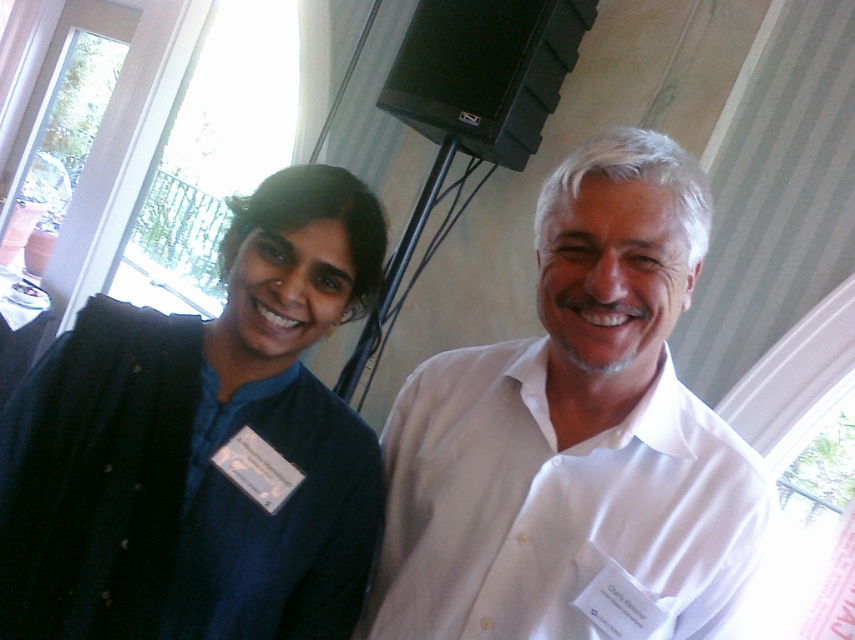
Question: Considering the relative positions of white cotton shirt at center and velvet blue shirt at left in the image provided, where is white cotton shirt at center located with respect to velvet blue shirt at left?

Choices:
 (A) left
 (B) right

Answer: (B)

Question: Is white cotton shirt at center closer to camera compared to velvet blue shirt at left?

Choices:
 (A) no
 (B) yes

Answer: (B)

Question: Which object is closer to the camera taking this photo?

Choices:
 (A) white cotton shirt at center
 (B) velvet blue shirt at left

Answer: (A)

Question: Can you confirm if white cotton shirt at center is positioned below velvet blue shirt at left?

Choices:
 (A) yes
 (B) no

Answer: (A)

Question: Which object appears farthest from the camera in this image?

Choices:
 (A) velvet blue shirt at left
 (B) white cotton shirt at center

Answer: (A)

Question: Which object is farther from the camera taking this photo?

Choices:
 (A) white cotton shirt at center
 (B) velvet blue shirt at left

Answer: (B)